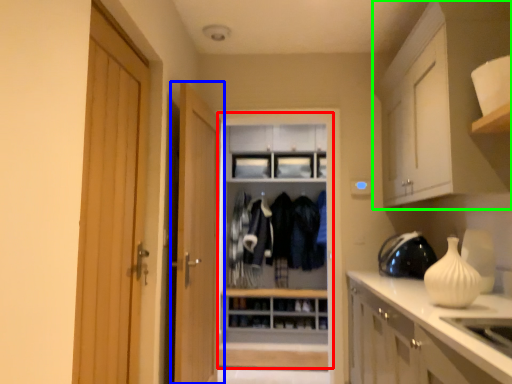
Question: Which object is positioned closest to dresser (highlighted by a red box)? Select from door (highlighted by a blue box) and cabinetry (highlighted by a green box).

Choices:
 (A) door
 (B) cabinetry

Answer: (A)